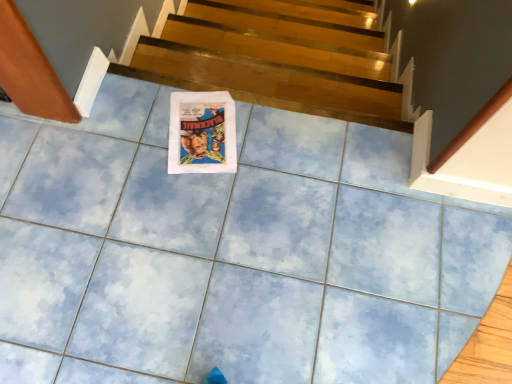
You are a GUI agent. You are given a task and a screenshot of the screen. Output one action in this format:
    pyautogui.click(x=<x>, y=<y>)
    Task: Click on the vacant region under matte paper poster at center (from a real-world perspective)
    
    Given the screenshot: What is the action you would take?
    pyautogui.click(x=200, y=135)